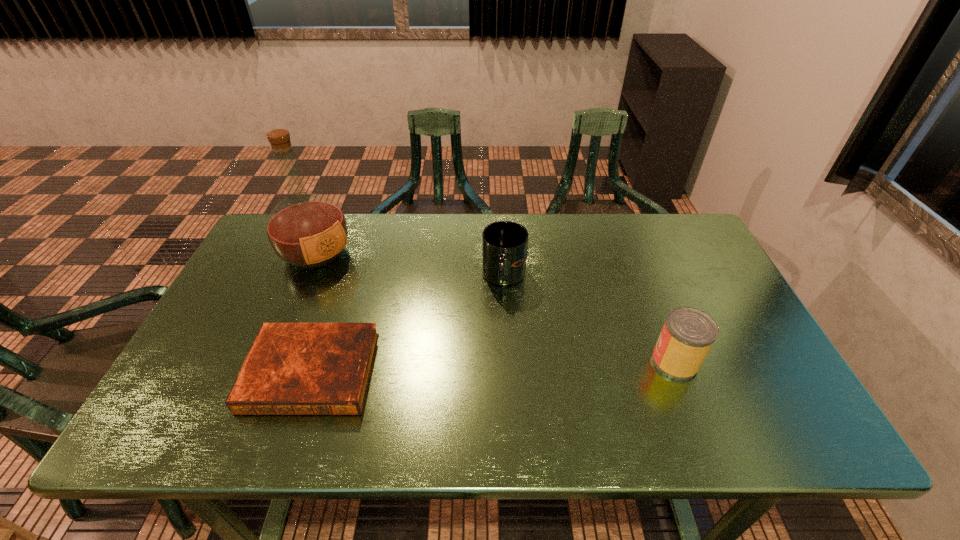
Where is `free spot between the mug and the liquor`? This screenshot has width=960, height=540. free spot between the mug and the liquor is located at coordinates (410, 265).

Find the location of a particular element. Image resolution: width=960 pixels, height=540 pixels. vacant area between the shortest object and the mug is located at coordinates (408, 325).

Identify the location of free space between the Bible and the tallest object. (314, 313).

This screenshot has width=960, height=540. Find the location of `object that is the second closest to the second object from right to left`. object that is the second closest to the second object from right to left is located at coordinates (688, 333).

Locate which object is the second closest to the mug. Please provide its 2D coordinates. Your answer should be formatted as a tuple, i.e. [(x, y)], where the tuple contains the x and y coordinates of a point satisfying the conditions above.

[(688, 333)]

I want to click on vacant space that satisfies the following two spatial constraints: 1. on the front side of the liquor; 2. on the left side of the mug, so click(306, 277).

Find the location of a particular element. This screenshot has width=960, height=540. free spot that satisfies the following two spatial constraints: 1. on the front side of the liquor; 2. on the left side of the can is located at coordinates (271, 361).